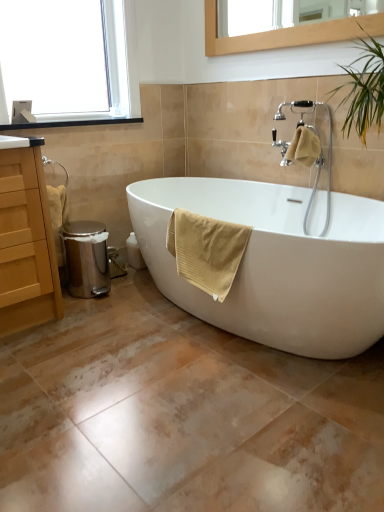
Question: Are white glossy bathtub at center and yellow textured towel at upper right, acting as the 2th bath towel starting from the front, making contact?

Choices:
 (A) yes
 (B) no

Answer: (B)

Question: From the image's perspective, is white glossy bathtub at center above yellow textured towel at upper right, acting as the first bath towel starting from the right?

Choices:
 (A) yes
 (B) no

Answer: (B)

Question: Considering the relative sizes of white glossy bathtub at center and yellow textured towel at upper right, the 2th bath towel from the left, in the image provided, is white glossy bathtub at center smaller than yellow textured towel at upper right, the 2th bath towel from the left,?

Choices:
 (A) yes
 (B) no

Answer: (B)

Question: From a real-world perspective, is white glossy bathtub at center physically below yellow textured towel at upper right, the 2th bath towel from the left?

Choices:
 (A) no
 (B) yes

Answer: (B)

Question: Are white glossy bathtub at center and yellow textured towel at upper right, arranged as the first bath towel when viewed from the top, far apart?

Choices:
 (A) yes
 (B) no

Answer: (B)

Question: From the image's perspective, relative to yellow textured towel at upper right, the second bath towel positioned from the bottom, is yellow cotton towel at lower center, positioned as the second bath towel in back-to-front order, above or below?

Choices:
 (A) below
 (B) above

Answer: (A)

Question: Choose the correct answer: Is yellow cotton towel at lower center, which is the first bath towel in left-to-right order, inside yellow textured towel at upper right, arranged as the first bath towel when viewed from the top, or outside it?

Choices:
 (A) outside
 (B) inside

Answer: (A)

Question: Looking at their shapes, would you say yellow cotton towel at lower center, positioned as the second bath towel in back-to-front order, is wider or thinner than yellow textured towel at upper right, which is the first bath towel from back to front?

Choices:
 (A) thin
 (B) wide

Answer: (A)

Question: Considering their positions, is yellow cotton towel at lower center, positioned as the second bath towel in top-to-bottom order, located in front of or behind yellow textured towel at upper right, acting as the 2th bath towel starting from the front?

Choices:
 (A) behind
 (B) front

Answer: (B)

Question: Considering their positions, is yellow cotton towel at lower center, which is the first bath towel in left-to-right order, located in front of or behind clear glass window at upper left?

Choices:
 (A) behind
 (B) front

Answer: (B)

Question: Based on their positions, is yellow cotton towel at lower center, which is the first bath towel in left-to-right order, located to the left or right of clear glass window at upper left?

Choices:
 (A) right
 (B) left

Answer: (A)

Question: Is yellow cotton towel at lower center, positioned as the second bath towel in back-to-front order, wider or thinner than clear glass window at upper left?

Choices:
 (A) thin
 (B) wide

Answer: (A)

Question: From a real-world perspective, is yellow cotton towel at lower center, which is the first bath towel in left-to-right order, positioned above or below clear glass window at upper left?

Choices:
 (A) below
 (B) above

Answer: (A)

Question: Considering their positions, is yellow textured towel at upper right, acting as the 2th bath towel starting from the front, located in front of or behind clear glass window at upper left?

Choices:
 (A) behind
 (B) front

Answer: (A)

Question: Is yellow textured towel at upper right, arranged as the first bath towel when viewed from the top, inside the boundaries of clear glass window at upper left, or outside?

Choices:
 (A) outside
 (B) inside

Answer: (A)